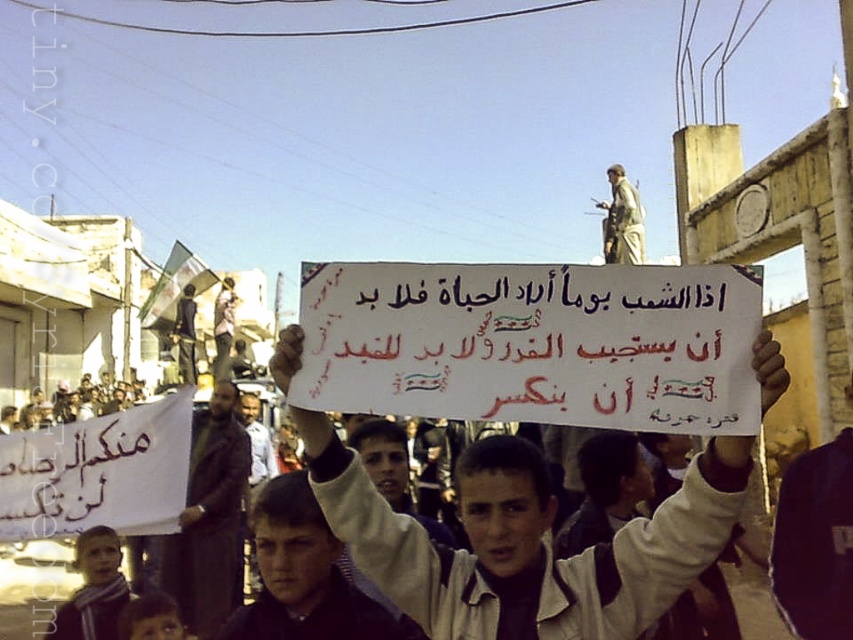
Which is more to the right, white cotton shirt at center or light brown scarf at lower left?

white cotton shirt at center is more to the right.

In the scene shown: Who is more forward, [647,541] or [97,616]?

Positioned in front is point [647,541].

The height and width of the screenshot is (640, 853). Find the location of `white cotton shirt at center`. white cotton shirt at center is located at coordinates (525, 541).

Can you confirm if light brown hair at center is smaller than light brown scarf at lower left?

Incorrect, light brown hair at center is not smaller in size than light brown scarf at lower left.

Looking at this image, which is more to the right, light brown hair at center or light brown scarf at lower left?

light brown hair at center is more to the right.

Does point (276, 509) lie behind point (84, 534)?

No.

Locate an element on the screen. light brown hair at center is located at coordinates (305, 577).

Which is below, dark brown leather jacket at lower left or light brown scarf at lower left?

light brown scarf at lower left is below.

Does point (167, 592) come closer to viewer compared to point (77, 589)?

Yes, it is in front of point (77, 589).

Does point (225, 596) come behind point (103, 636)?

Yes, it is.

Where is `dark brown leather jacket at lower left`? This screenshot has width=853, height=640. dark brown leather jacket at lower left is located at coordinates (210, 518).